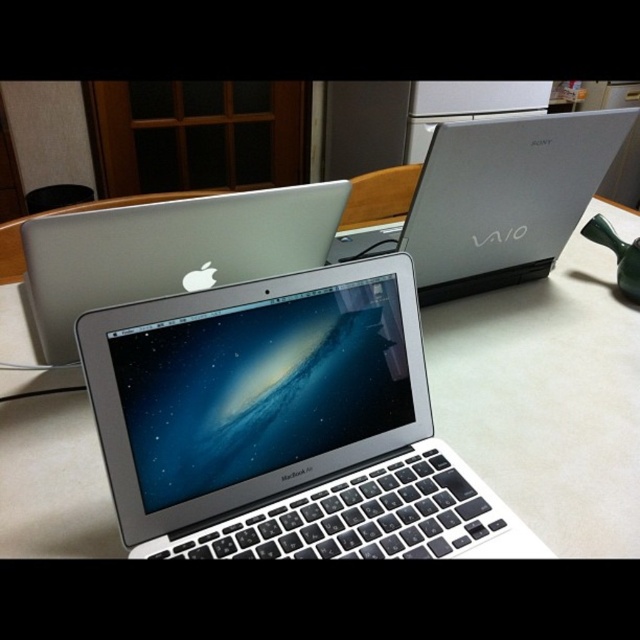
Does white glossy table at center have a greater height compared to sleek silver laptop at center?

Correct, white glossy table at center is much taller as sleek silver laptop at center.

Image resolution: width=640 pixels, height=640 pixels. In order to click on white glossy table at center in this screenshot , I will do `click(548, 396)`.

The height and width of the screenshot is (640, 640). Find the location of `white glossy table at center`. white glossy table at center is located at coordinates (548, 396).

Can you confirm if sleek silver laptop at center is positioned to the right of satin silver laptop at center?

Correct, you'll find sleek silver laptop at center to the right of satin silver laptop at center.

Between sleek silver laptop at center and satin silver laptop at center, which one has less height?

satin silver laptop at center is shorter.

You are a GUI agent. You are given a task and a screenshot of the screen. Output one action in this format:
    pyautogui.click(x=<x>, y=<y>)
    Task: Click on the sleek silver laptop at center
    The width and height of the screenshot is (640, 640).
    Given the screenshot: What is the action you would take?
    click(497, 198)

Is point (45, 518) farther from camera compared to point (56, 243)?

No.

Between point (625, 490) and point (170, 248), which one is positioned in front?

Point (625, 490) is more forward.

Which is behind, point (19, 476) or point (72, 237)?

The point (19, 476) is more distant.

Locate an element on the screen. This screenshot has height=640, width=640. white glossy table at center is located at coordinates (548, 396).